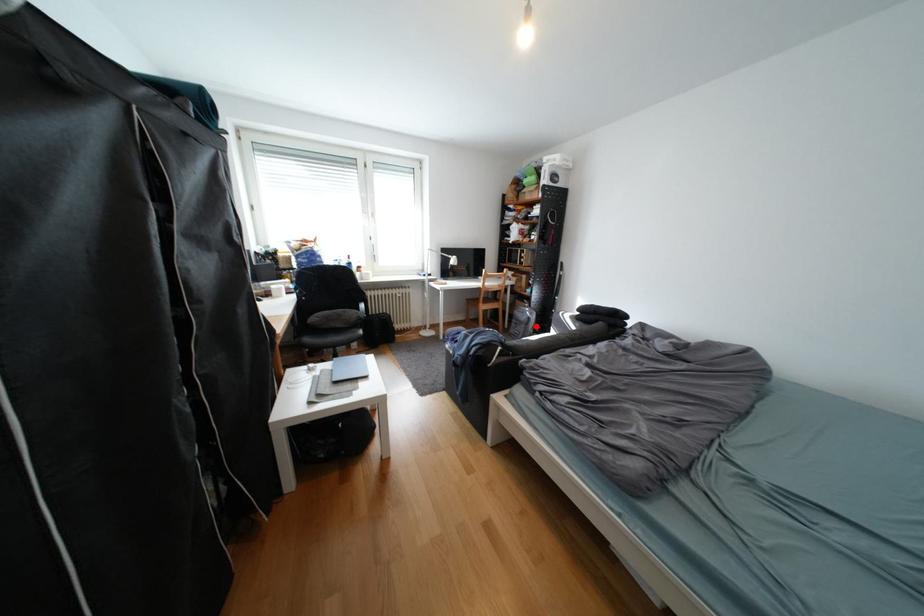
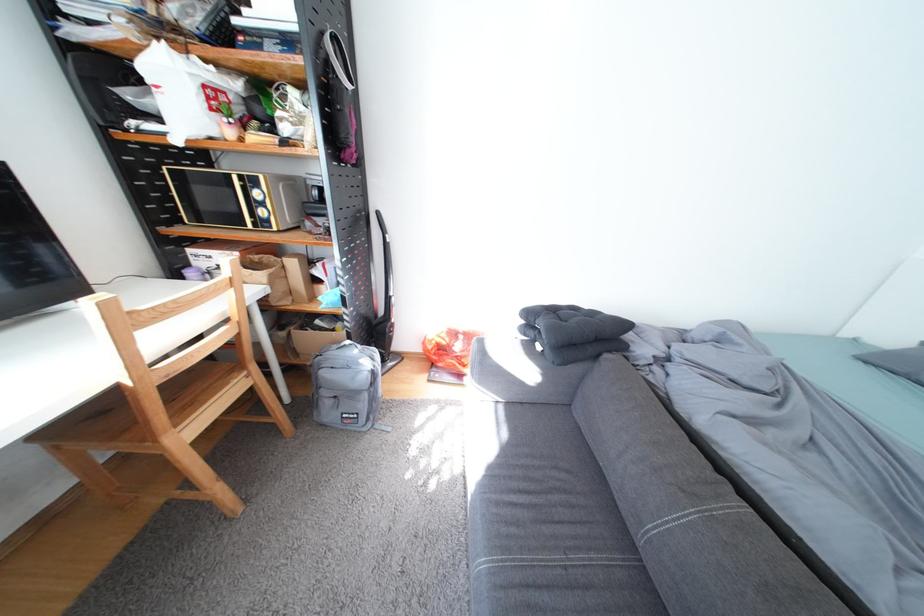
Find the pixel in the second image that matches the highlighted location in the first image.

(378, 397)